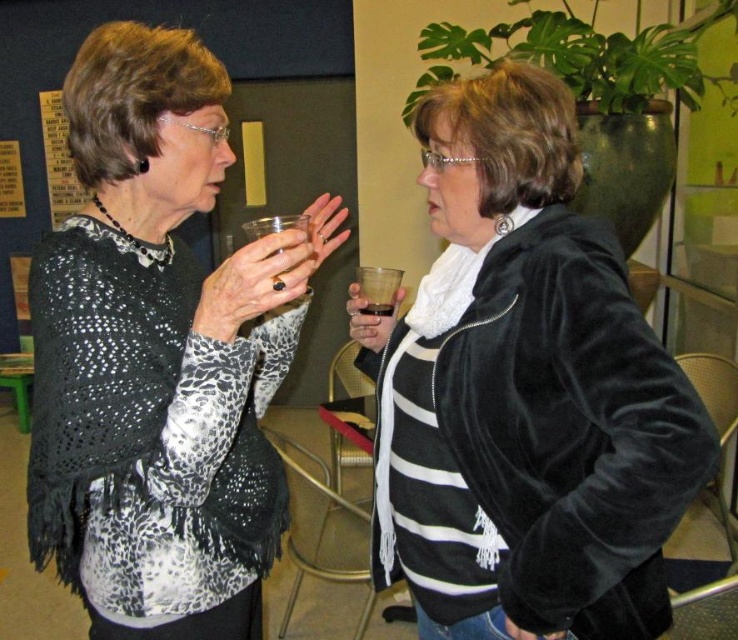
You are standing at the entrance of the room and want to place a new cup exactly where the translucent plastic cup at center is currently located. What are the coordinates you should aim for?

The coordinates for the translucent plastic cup at center are (379, 289).

Consider the image. You are trying to place a decorative plate at the exact center of the room. The exact center is at point coordinates of 0.5, 0.5. Is the translucent plastic cup at center closer to the center than 0.05 units?

The translucent plastic cup at center is located at point coordinates of (x=379, y=289). The distance from the center is calculated as sqrt of squared differences between 0.5 and 0.453 and between 0.5 and 0.514. The differences are 0.047 and 0.014 respectively. Squaring them gives 0.0022 and 0.0002. Summing them gives 0.0024. Square root of that is approximately 0.049 units. Since 0.049 is less than 0.05, the cup is within 0.05 units of the center. Therefore, the translucent plastic cup at center is closer to

You are at a party and want to pour a drink into either the translucent plastic cup at center or the dark red glass at center. If you want a wider rim for easier sipping, which one should you choose?

The translucent plastic cup at center might be wider than the dark red glass at center, so you should choose the translucent plastic cup at center for a wider rim.